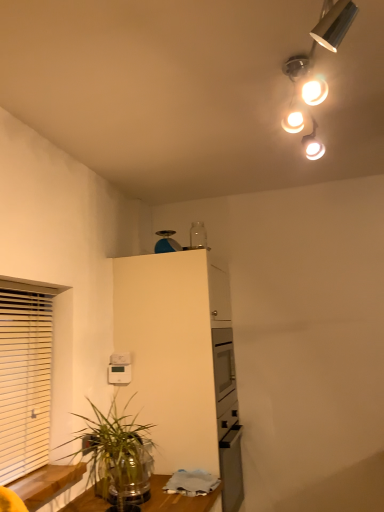
Locate an element on the screen. The height and width of the screenshot is (512, 384). empty space that is ontop of matte silver lamp at upper right (from a real-world perspective) is located at coordinates (309, 60).